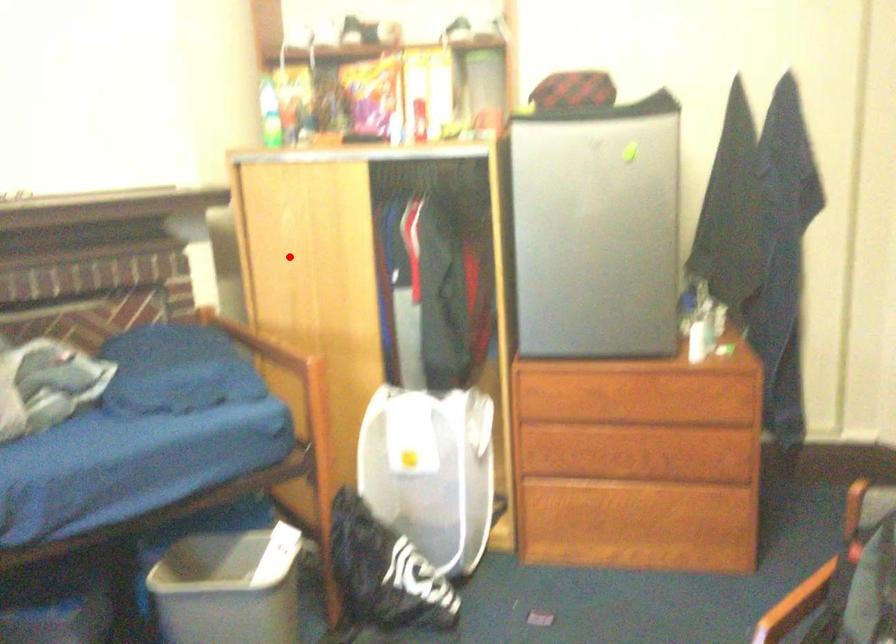
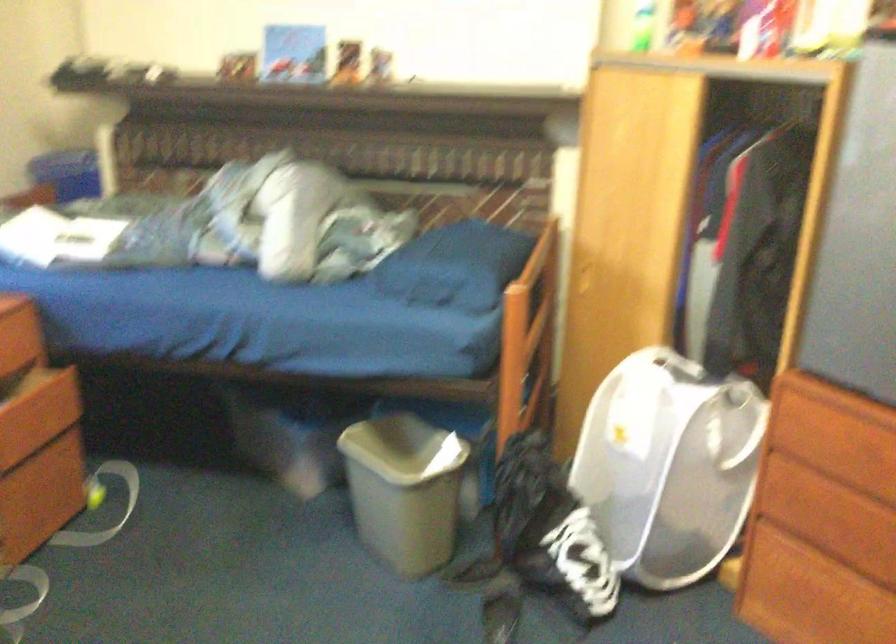
The point at the highlighted location is marked in the first image. Where is the corresponding point in the second image?

(613, 182)